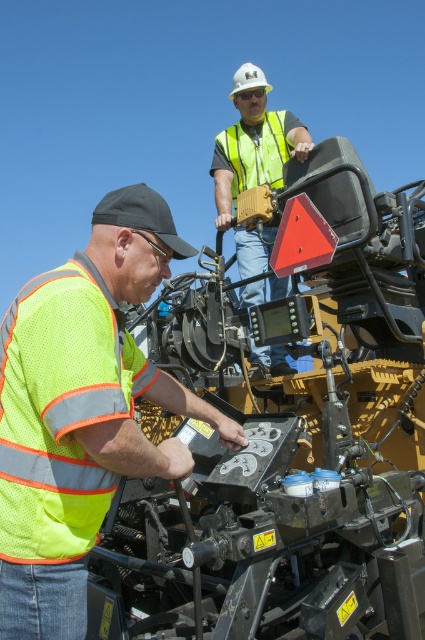
Can you confirm if neon yellow safety vest at lower left is taller than neon yellow mesh safety vest at left?

Indeed, neon yellow safety vest at lower left has a greater height compared to neon yellow mesh safety vest at left.

Can you confirm if neon yellow safety vest at lower left is positioned to the right of neon yellow mesh safety vest at left?

Correct, you'll find neon yellow safety vest at lower left to the right of neon yellow mesh safety vest at left.

You are a GUI agent. You are given a task and a screenshot of the screen. Output one action in this format:
    pyautogui.click(x=<x>, y=<y>)
    Task: Click on the neon yellow safety vest at lower left
    
    Given the screenshot: What is the action you would take?
    pyautogui.click(x=82, y=410)

Which of these two, neon yellow mesh safety vest at left or high-visibility reflective vest at upper center, stands shorter?

neon yellow mesh safety vest at left is shorter.

Describe the element at coordinates (59, 412) in the screenshot. The width and height of the screenshot is (425, 640). I see `neon yellow mesh safety vest at left` at that location.

The width and height of the screenshot is (425, 640). What are the coordinates of `neon yellow mesh safety vest at left` in the screenshot? It's located at [x=59, y=412].

Does high-visibility reflective vest at upper center come in front of high-visibility reflective safety vest at upper center?

Yes.

Is high-visibility reflective vest at upper center bigger than high-visibility reflective safety vest at upper center?

Yes, high-visibility reflective vest at upper center is bigger than high-visibility reflective safety vest at upper center.

Which is behind, point (285, 285) or point (275, 170)?

Point (275, 170)

Find the location of a particular element. This screenshot has height=640, width=425. high-visibility reflective vest at upper center is located at coordinates (254, 144).